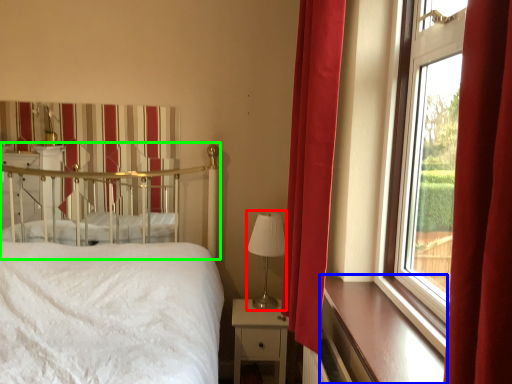
Question: Considering the real-world distances, which object is farthest from table lamp (highlighted by a red box)? window sill (highlighted by a blue box) or canopy bed (highlighted by a green box)?

Choices:
 (A) window sill
 (B) canopy bed

Answer: (B)